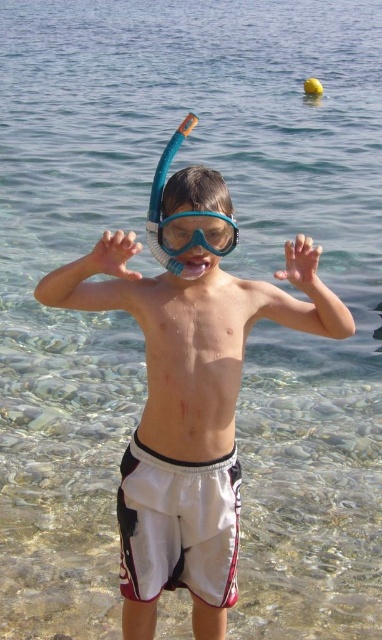
In the scene shown: Is white fabric at center thinner than translucent plastic hand at center?

No.

Does white fabric at center have a larger size compared to translucent plastic hand at center?

Indeed, white fabric at center has a larger size compared to translucent plastic hand at center.

Is point (200, 432) less distant than point (116, 264)?

No, it is not.

This screenshot has height=640, width=382. What are the coordinates of `white fabric at center` in the screenshot? It's located at (192, 358).

Who is taller, white fabric at center or blue matte snorkel mask at center?

white fabric at center is taller.

Does white fabric at center appear on the left side of blue matte snorkel mask at center?

Correct, you'll find white fabric at center to the left of blue matte snorkel mask at center.

Is point (189, 442) closer to camera compared to point (197, 216)?

That is False.

I want to click on white fabric at center, so click(192, 358).

What do you see at coordinates (184, 216) in the screenshot? The image size is (382, 640). I see `blue rubber snorkel at center` at bounding box center [184, 216].

Can you confirm if blue rubber snorkel at center is shorter than translucent plastic hand at center?

Yes.

Measure the distance between point (195, 227) and camera.

Point (195, 227) is 4.77 meters from camera.

Locate an element on the screen. This screenshot has height=640, width=382. blue rubber snorkel at center is located at coordinates (184, 216).